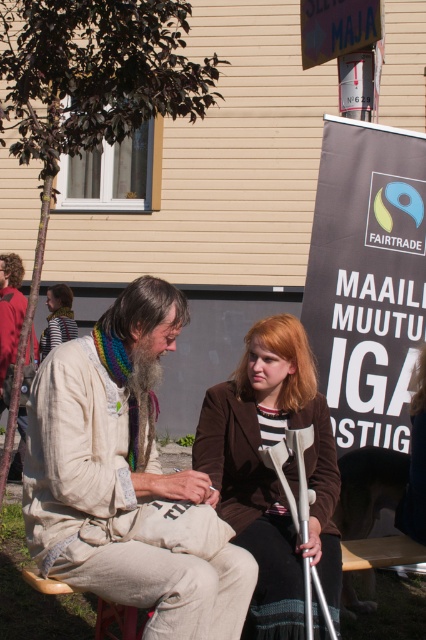
Question: Can you confirm if brown fabric crutches at center is positioned to the right of beige fabric jacket at lower left?

Choices:
 (A) no
 (B) yes

Answer: (B)

Question: Which point appears closest to the camera in this image?

Choices:
 (A) (23, 428)
 (B) (78, 500)
 (C) (294, 536)

Answer: (B)

Question: Is brown fabric crutches at center below beige fabric jacket at lower left?

Choices:
 (A) yes
 (B) no

Answer: (A)

Question: Which point is closer to the camera?

Choices:
 (A) (155, 506)
 (B) (22, 429)
 (C) (281, 596)

Answer: (A)

Question: In this image, where is light beige fabric jacket at center located relative to beige fabric jacket at lower left?

Choices:
 (A) above
 (B) below

Answer: (B)

Question: Estimate the real-world distances between objects in this image. Which object is closer to the beige fabric jacket at lower left?

Choices:
 (A) brown fabric crutches at center
 (B) light beige fabric jacket at center

Answer: (A)